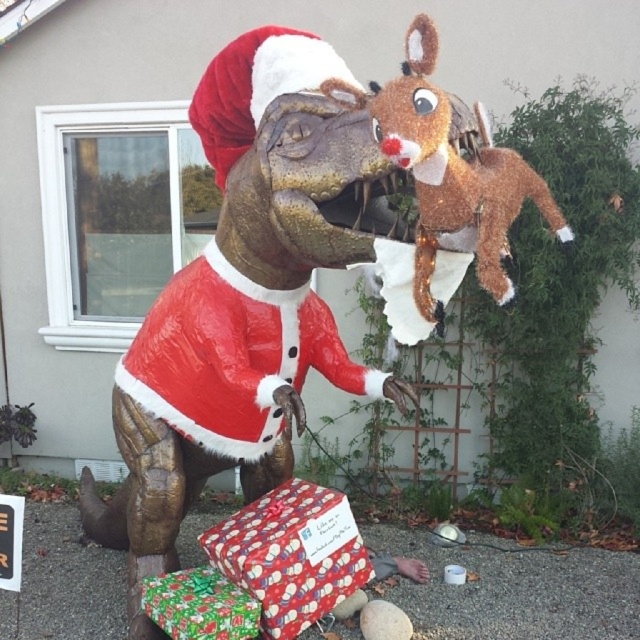
Question: Which point is farther to the camera?

Choices:
 (A) (180, 616)
 (B) (232, 566)

Answer: (B)

Question: Can you confirm if fuzzy brown reindeer at upper right is positioned above shiny paper gift at lower center?

Choices:
 (A) no
 (B) yes

Answer: (B)

Question: Which of the following is the closest to the observer?

Choices:
 (A) wrapping paper gift at lower center
 (B) fuzzy brown reindeer at upper right
 (C) shiny plastic dinosaur at center
 (D) shiny paper gift at lower center

Answer: (B)

Question: Is shiny plastic dinosaur at center thinner than shiny paper gift at lower center?

Choices:
 (A) no
 (B) yes

Answer: (A)

Question: Which point is farther from the camera taking this photo?

Choices:
 (A) (401, 83)
 (B) (113, 388)

Answer: (B)

Question: Does shiny plastic dinosaur at center lie in front of fuzzy brown reindeer at upper right?

Choices:
 (A) yes
 (B) no

Answer: (B)